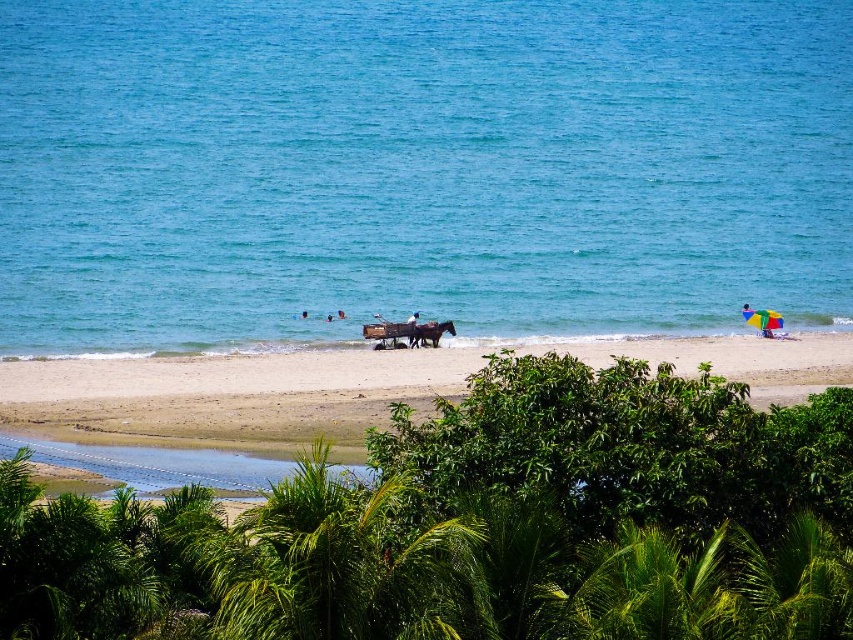
Question: Which of these objects is positioned farthest from the blue water at center?

Choices:
 (A) brown glossy horse at center
 (B) dark blue fabric at center
 (C) white sand beach at center
 (D) multicolored fabric umbrella at right

Answer: (B)

Question: Does multicolored fabric umbrella at right appear over dark blue fabric at center?

Choices:
 (A) no
 (B) yes

Answer: (B)

Question: Does white sand beach at center appear on the right side of multicolored fabric umbrella at right?

Choices:
 (A) no
 (B) yes

Answer: (A)

Question: Estimate the real-world distances between objects in this image. Which object is farther from the dark blue fabric at center?

Choices:
 (A) white sand beach at center
 (B) multicolored fabric umbrella at right
 (C) blue fabric umbrella at center

Answer: (C)

Question: Does brown glossy horse at center have a lesser width compared to blue fabric umbrella at center?

Choices:
 (A) yes
 (B) no

Answer: (B)

Question: Which point appears farthest from the camera in this image?

Choices:
 (A) (123, 248)
 (B) (744, 314)
 (C) (82, 384)
 (D) (407, 337)

Answer: (A)